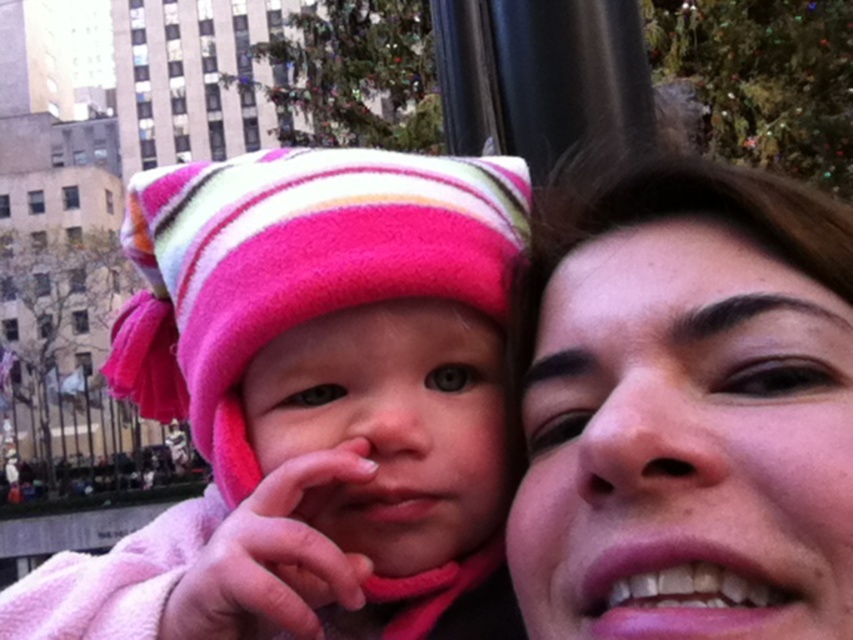
Which of these two, matte fleece hat at left or smooth skin face at right, stands shorter?

matte fleece hat at left is shorter.

Locate an element on the screen. This screenshot has width=853, height=640. matte fleece hat at left is located at coordinates (x=308, y=397).